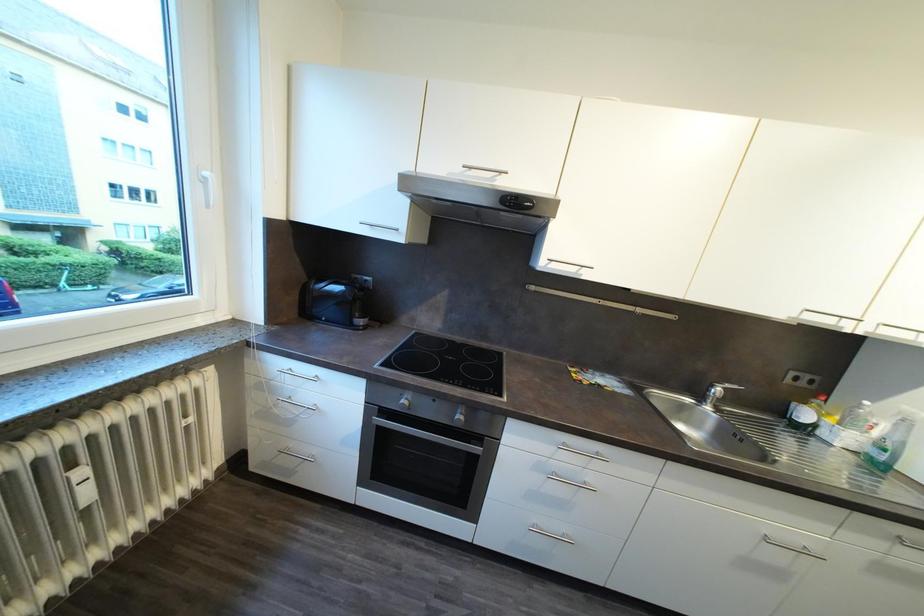
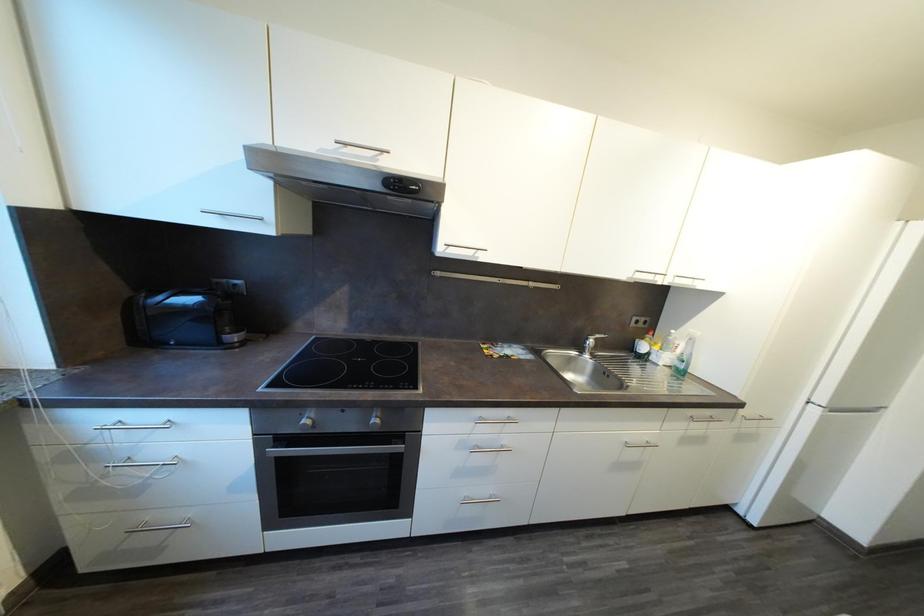
Question: The camera is either moving clockwise (left) or counter-clockwise (right) around the object. The first image is from the beginning of the video and the second image is from the end. Is the camera moving left or right when shooting the video?

Choices:
 (A) Left
 (B) Right

Answer: (A)